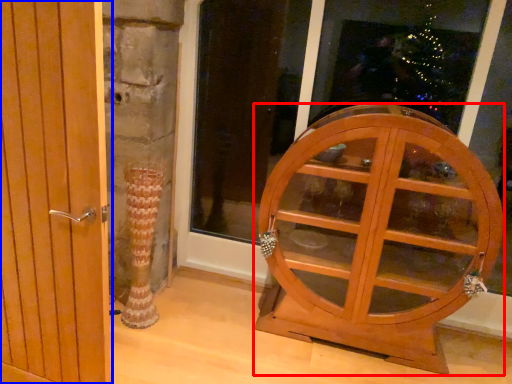
Question: Which object is closer to the camera taking this photo, furniture (highlighted by a red box) or door (highlighted by a blue box)?

Choices:
 (A) furniture
 (B) door

Answer: (B)